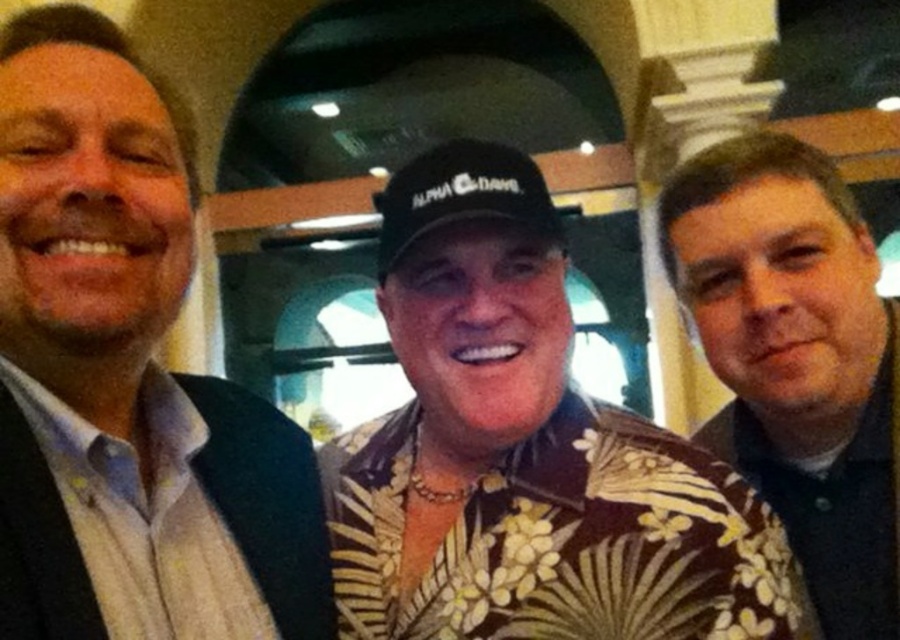
Is brown floral shirt at center smaller than brown textured shirt at right?

No, brown floral shirt at center is not smaller than brown textured shirt at right.

Who is taller, brown floral shirt at center or brown textured shirt at right?

Standing taller between the two is brown textured shirt at right.

At what (x,y) coordinates should I click in order to perform the action: click on brown floral shirt at center. Please return your answer as a coordinate pair (x, y). The image size is (900, 640). Looking at the image, I should click on pos(525,451).

Can you confirm if white shirt at left is bigger than brown floral shirt at center?

No.

Is white shirt at left taller than brown floral shirt at center?

Indeed, white shirt at left has a greater height compared to brown floral shirt at center.

Is point (159, 132) closer to viewer compared to point (472, 148)?

Yes, point (159, 132) is closer to viewer.

What are the coordinates of `white shirt at left` in the screenshot? It's located at (126, 376).

In the scene shown: Is white shirt at left thinner than black fabric baseball cap at center?

No.

Is point (205, 481) farther from camera compared to point (513, 204)?

Yes, point (205, 481) is farther from viewer.

Locate an element on the screen. The width and height of the screenshot is (900, 640). white shirt at left is located at coordinates pos(126,376).